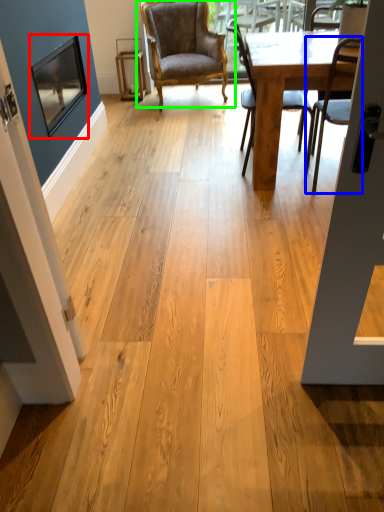
Question: Which is nearer to the window screen (highlighted by a red box)? chair (highlighted by a blue box) or chair (highlighted by a green box).

Choices:
 (A) chair
 (B) chair

Answer: (B)